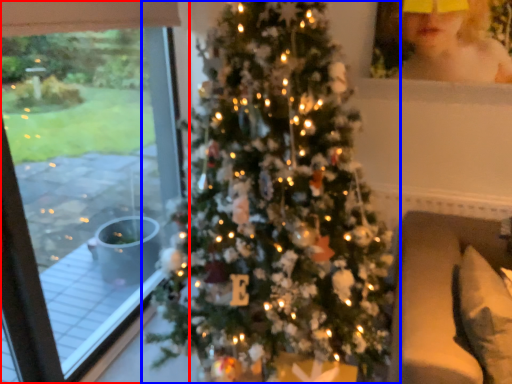
Question: Among these objects, which one is nearest to the camera, window (highlighted by a red box) or christmas tree (highlighted by a blue box)?

Choices:
 (A) window
 (B) christmas tree

Answer: (B)